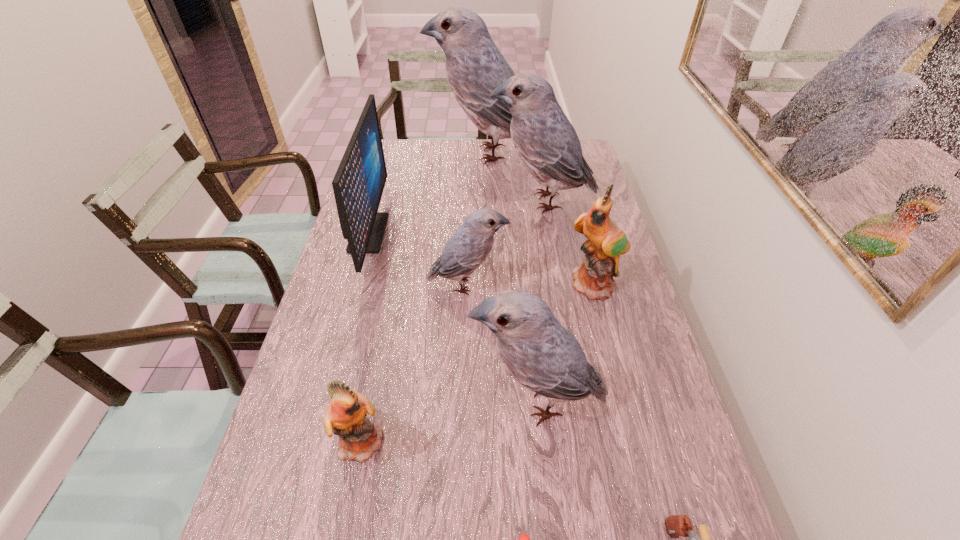
I want to click on the smaller green parrot, so click(x=345, y=416).

I want to click on the third farthest gray parrot, so click(x=468, y=248).

The width and height of the screenshot is (960, 540). Identify the location of vacant position located 0.160m on the front-facing side of the farthest parrot. (391, 153).

This screenshot has height=540, width=960. I want to click on vacant space located on the front-facing side of the farthest parrot, so click(x=391, y=153).

The width and height of the screenshot is (960, 540). Find the location of `free region located 0.050m on the front-facing side of the farthest parrot`. free region located 0.050m on the front-facing side of the farthest parrot is located at coordinates (418, 153).

The image size is (960, 540). Identify the location of vacant position located 0.330m on the front-facing side of the second tallest object. (396, 201).

Locate an element on the screen. This screenshot has width=960, height=540. vacant space located 0.120m on the front-facing side of the second tallest object is located at coordinates (454, 201).

Locate an element on the screen. vacant space located on the front-facing side of the second tallest object is located at coordinates (416, 201).

I want to click on vacant point located on the screen side of the leftmost object, so click(x=495, y=233).

Where is `free region located 0.110m on the front-facing side of the right green parrot`? The height and width of the screenshot is (540, 960). free region located 0.110m on the front-facing side of the right green parrot is located at coordinates (608, 335).